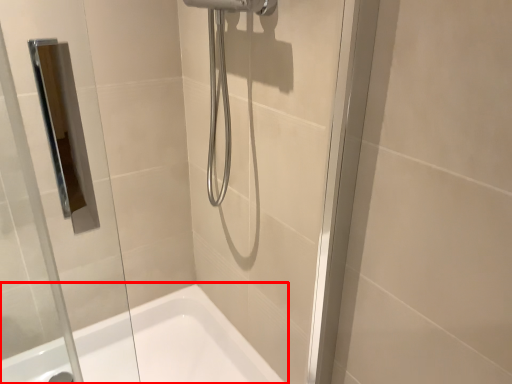
Question: Considering the relative positions of bathtub (annotated by the red box) and glass door in the image provided, where is bathtub (annotated by the red box) located with respect to the staircase?

Choices:
 (A) left
 (B) right

Answer: (A)